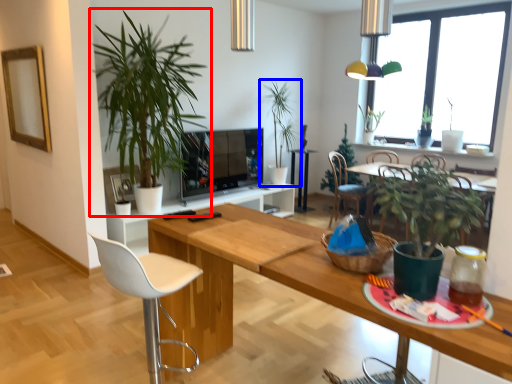
Question: Which object is further to the camera taking this photo, houseplant (highlighted by a red box) or houseplant (highlighted by a blue box)?

Choices:
 (A) houseplant
 (B) houseplant

Answer: (B)